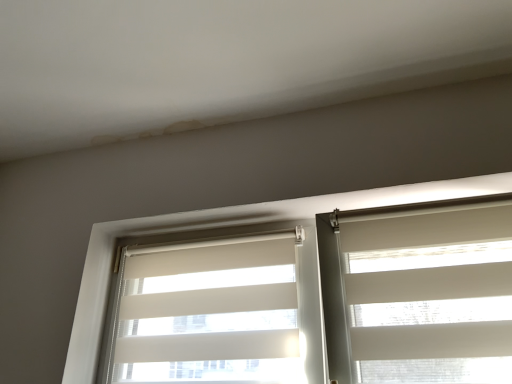
Question: Is white fabric window blind at left, placed as the 1th window blind when sorted from left to right, completely or partially outside of white fabric window blind at right, the first window blind viewed from the right?

Choices:
 (A) yes
 (B) no

Answer: (A)

Question: From a real-world perspective, is white fabric window blind at left, placed as the 1th window blind when sorted from left to right, on top of white fabric window blind at right, the second window blind when ordered from left to right?

Choices:
 (A) yes
 (B) no

Answer: (A)

Question: From the image's perspective, does white fabric window blind at left, the second window blind viewed from the right, appear lower than white fabric window blind at right, the first window blind viewed from the right?

Choices:
 (A) no
 (B) yes

Answer: (B)

Question: Is white fabric window blind at left, placed as the 1th window blind when sorted from left to right, wider than white fabric window blind at right, the first window blind viewed from the right?

Choices:
 (A) no
 (B) yes

Answer: (A)

Question: Would you say white fabric window blind at left, placed as the 1th window blind when sorted from left to right, contains white fabric window blind at right, the second window blind when ordered from left to right?

Choices:
 (A) no
 (B) yes

Answer: (A)

Question: From a real-world perspective, is white fabric blinds at center above or below white fabric window blind at right, the first window blind viewed from the right?

Choices:
 (A) above
 (B) below

Answer: (A)

Question: In the image, is white fabric blinds at center on the left side or the right side of white fabric window blind at right, the first window blind viewed from the right?

Choices:
 (A) right
 (B) left

Answer: (B)

Question: Choose the correct answer: Is white fabric blinds at center inside white fabric window blind at right, the second window blind when ordered from left to right, or outside it?

Choices:
 (A) inside
 (B) outside

Answer: (B)

Question: Relative to white fabric window blind at right, the first window blind viewed from the right, is white fabric blinds at center in front or behind?

Choices:
 (A) behind
 (B) front

Answer: (A)

Question: Which is correct: white fabric window blind at right, the first window blind viewed from the right, is inside white fabric blinds at center, or outside of it?

Choices:
 (A) inside
 (B) outside

Answer: (A)

Question: Considering the positions of point (382, 365) and point (216, 208), is point (382, 365) closer or farther from the camera than point (216, 208)?

Choices:
 (A) farther
 (B) closer

Answer: (B)

Question: Looking at the image, does white fabric window blind at right, the second window blind when ordered from left to right, seem bigger or smaller compared to white fabric blinds at center?

Choices:
 (A) small
 (B) big

Answer: (A)

Question: Considering the positions of white fabric window blind at right, the first window blind viewed from the right, and white fabric blinds at center in the image, is white fabric window blind at right, the first window blind viewed from the right, taller or shorter than white fabric blinds at center?

Choices:
 (A) short
 (B) tall

Answer: (A)

Question: Is white fabric blinds at center bigger or smaller than white fabric window blind at left, placed as the 1th window blind when sorted from left to right?

Choices:
 (A) small
 (B) big

Answer: (B)

Question: Is white fabric blinds at center taller or shorter than white fabric window blind at left, placed as the 1th window blind when sorted from left to right?

Choices:
 (A) tall
 (B) short

Answer: (A)